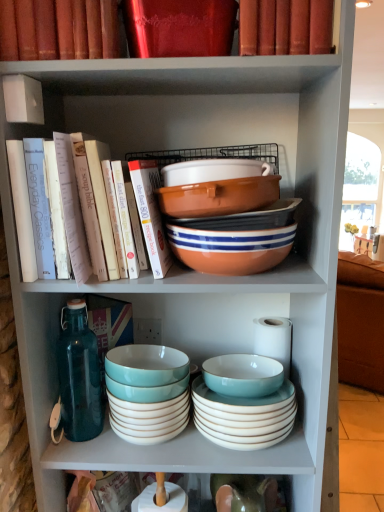
Question: Visually, is shiny red book at upper center, which appears as the second book when ordered from the bottom, positioned to the left or to the right of hardcover books at left, positioned as the 4th book in top-to-bottom order?

Choices:
 (A) left
 (B) right

Answer: (B)

Question: Is shiny red book at upper center, which appears as the second book when ordered from the bottom, wider or thinner than hardcover books at left, positioned as the 4th book in top-to-bottom order?

Choices:
 (A) thin
 (B) wide

Answer: (A)

Question: Based on their relative distances, which object is farther from the matte orange bowl at center, the second bowl viewed from the top?

Choices:
 (A) hardcover books at left, which is counted as the first book, starting from the bottom
 (B) shiny red book at upper center, which appears as the second book when ordered from the bottom
 (C) matte ceramic bowl at center, the third bowl viewed from the top
 (D) teal glossy bowl at center, the third bowl ordered from the bottom
 (E) teal ceramic bowls at center, the 1th bowl from the bottom

Answer: (E)

Question: Estimate the real-world distances between objects in this image. Which object is farther from the matte red book at upper center, the 3th book from the bottom?

Choices:
 (A) teal glossy bowl at center, the 5th bowl positioned from the top
 (B) matte red book at upper center, placed as the 1th book when sorted from top to bottom
 (C) hardcover books at left, positioned as the 4th book in top-to-bottom order
 (D) matte ceramic bowl at center, the fifth bowl positioned from the bottom
 (E) shiny red book at upper center, acting as the 3th book starting from the top

Answer: (A)